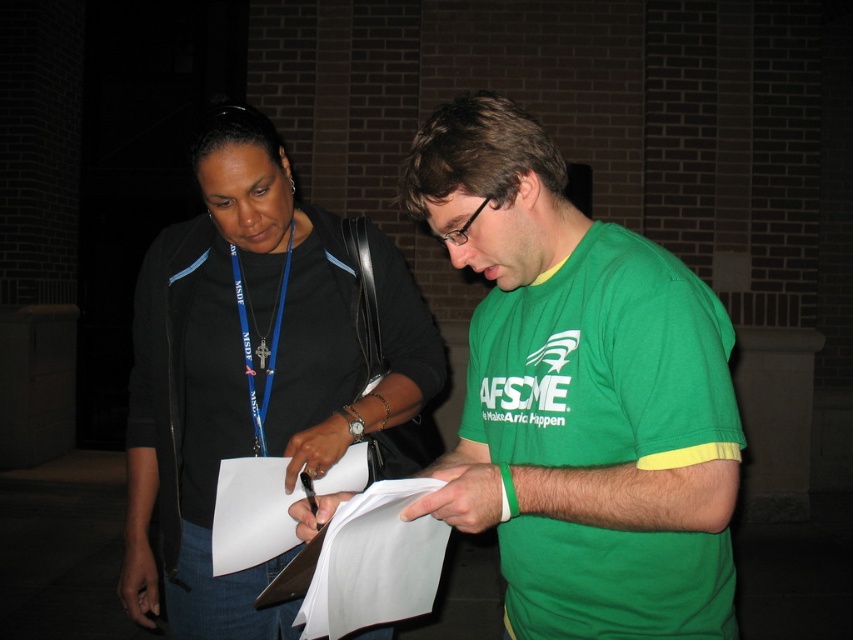
Is white paper at center smaller than blue fabric lanyard at center?

No.

Which is in front, point (252, 552) or point (239, 288)?

Point (252, 552) is more forward.

What are the coordinates of `white paper at center` in the screenshot? It's located at (251, 513).

Looking at this image, does white paper clipboard at center have a smaller size compared to blue fabric lanyard at center?

Incorrect, white paper clipboard at center is not smaller in size than blue fabric lanyard at center.

Does white paper clipboard at center have a lesser width compared to blue fabric lanyard at center?

No, white paper clipboard at center is not thinner than blue fabric lanyard at center.

Is point (372, 497) in front of point (267, 372)?

Yes, point (372, 497) is closer to viewer.

Where is `white paper clipboard at center`? The width and height of the screenshot is (853, 640). white paper clipboard at center is located at coordinates (364, 563).

Does green fabric shirt at center have a lesser width compared to black fabric shirt at center?

Correct, green fabric shirt at center's width is less than black fabric shirt at center's.

Does point (485, 424) come behind point (233, 136)?

That is False.

I want to click on green fabric shirt at center, so click(579, 396).